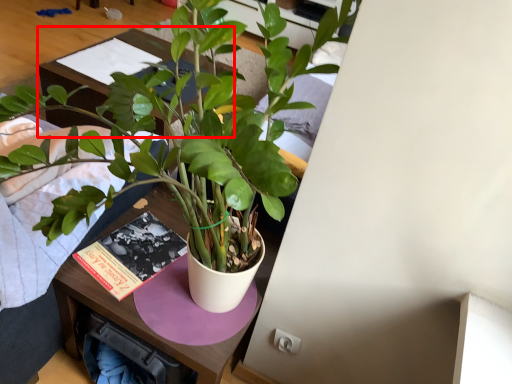
Question: From the image, what is the correct spatial relationship of table (annotated by the red box) in relation to houseplant?

Choices:
 (A) right
 (B) left

Answer: (B)